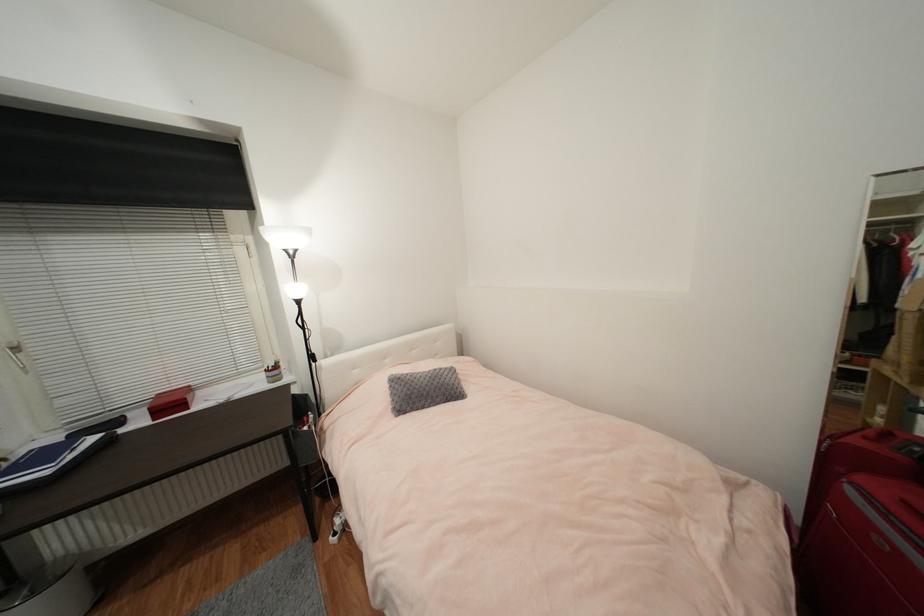
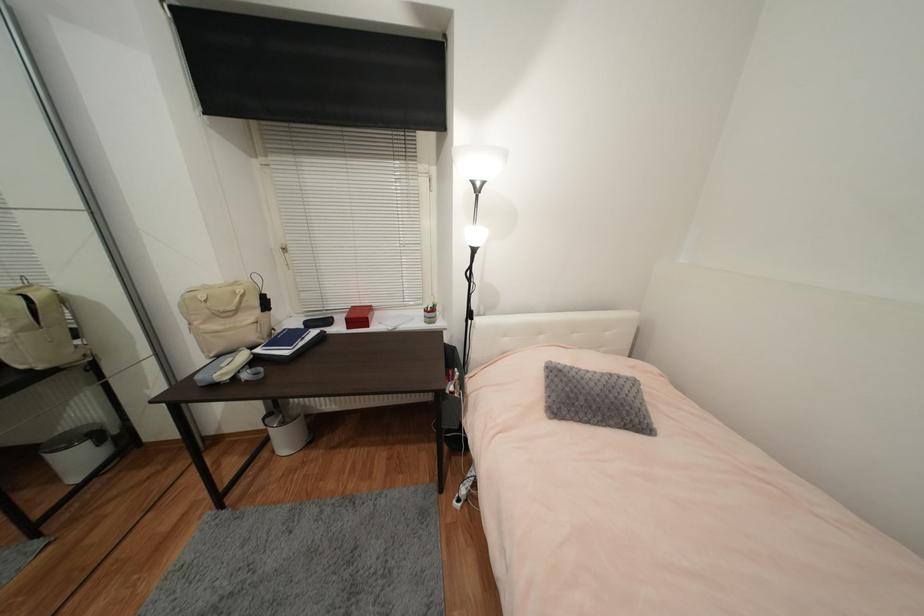
The point at [76,456] is marked in the first image. Where is the corresponding point in the second image?

(306, 344)